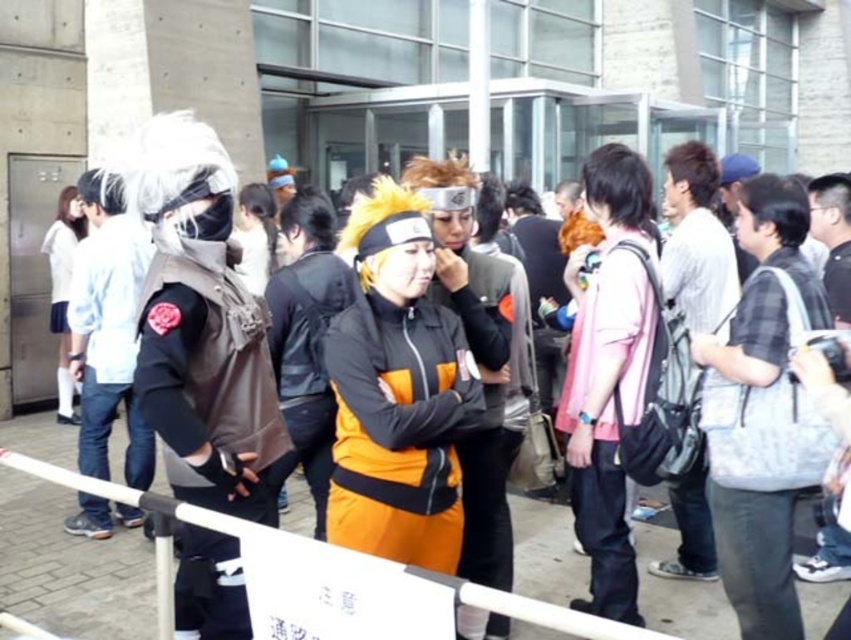
Is orange matte jacket at center bigger than white plastic barrier at center?

No, orange matte jacket at center is not bigger than white plastic barrier at center.

In order to click on orange matte jacket at center in this screenshot , I will do `click(398, 429)`.

The image size is (851, 640). What are the coordinates of `orange matte jacket at center` in the screenshot? It's located at (398, 429).

Is the position of matte black vest at center less distant than that of orange matte jacket at center?

Yes, it is in front of orange matte jacket at center.

The image size is (851, 640). Describe the element at coordinates (201, 324) in the screenshot. I see `matte black vest at center` at that location.

In order to click on matte black vest at center in this screenshot , I will do `click(201, 324)`.

Image resolution: width=851 pixels, height=640 pixels. What are the coordinates of `matte black vest at center` in the screenshot? It's located at (201, 324).

Does matte black vest at center have a greater height compared to pink fabric shirt at center?

Yes, matte black vest at center is taller than pink fabric shirt at center.

Between point (167, 120) and point (591, 300), which one is positioned in front?

Positioned in front is point (167, 120).

Is point (168, 170) less distant than point (590, 336)?

Yes, point (168, 170) is closer to viewer.

Where is `matte black vest at center`? This screenshot has width=851, height=640. matte black vest at center is located at coordinates (201, 324).